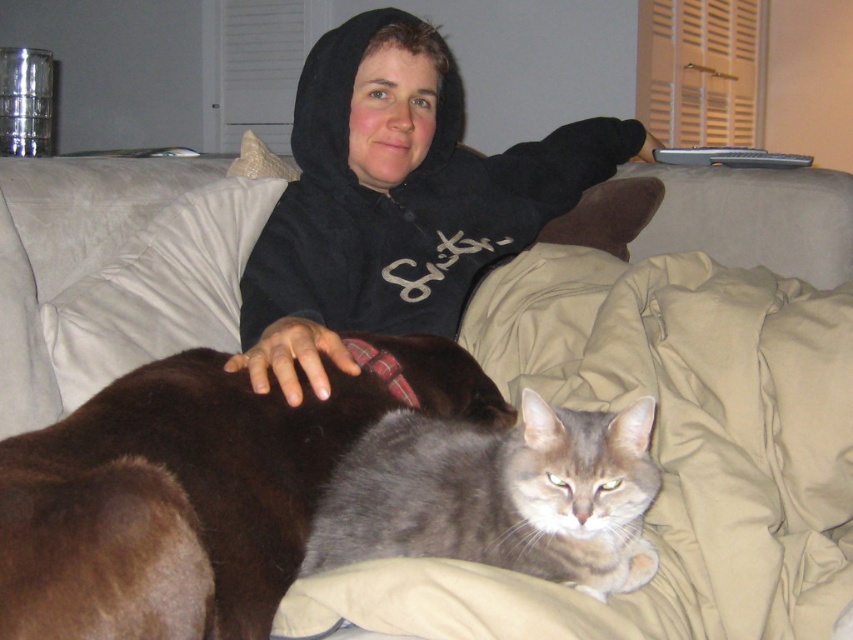
You are a tailor measuring clothing for alterations. You see the black hoodie at upper center and the matte gray pillow at upper right. Which item has a greater height?

The black hoodie at upper center is taller than the matte gray pillow at upper right according to the description provided.

You are a delivery robot with a package that needs to be placed on the floor next to the brown fur cat at center. The robot has a height of 1.2 meters. Can the robot safely place the package without hitting the cat?

The distance between the brown fur cat at center and the viewer is 70.99 centimeters. Since the robot is 1.2 meters tall, it can safely place the package next to the brown fur cat at center as the cat is within reach and the robot can maneuver without obstruction.